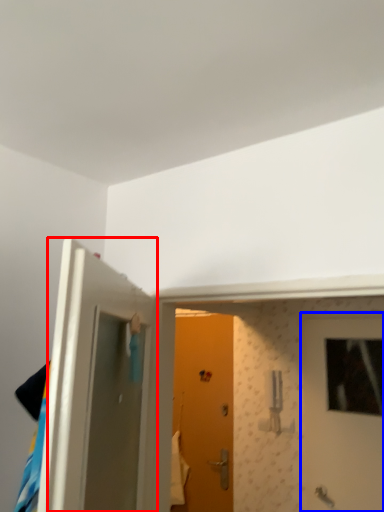
Question: Which object appears closest to the camera in this image, door (highlighted by a red box) or door (highlighted by a blue box)?

Choices:
 (A) door
 (B) door

Answer: (A)